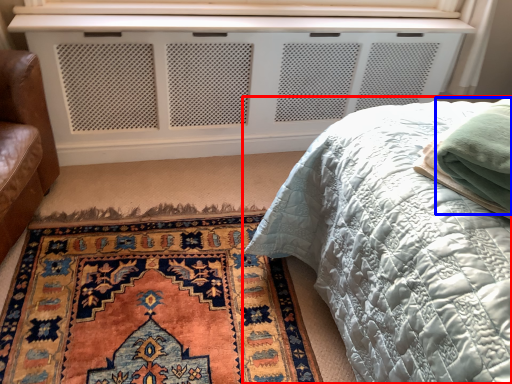
Question: Which point is closer to the camera, bed (highlighted by a red box) or material (highlighted by a blue box)?

Choices:
 (A) bed
 (B) material

Answer: (A)